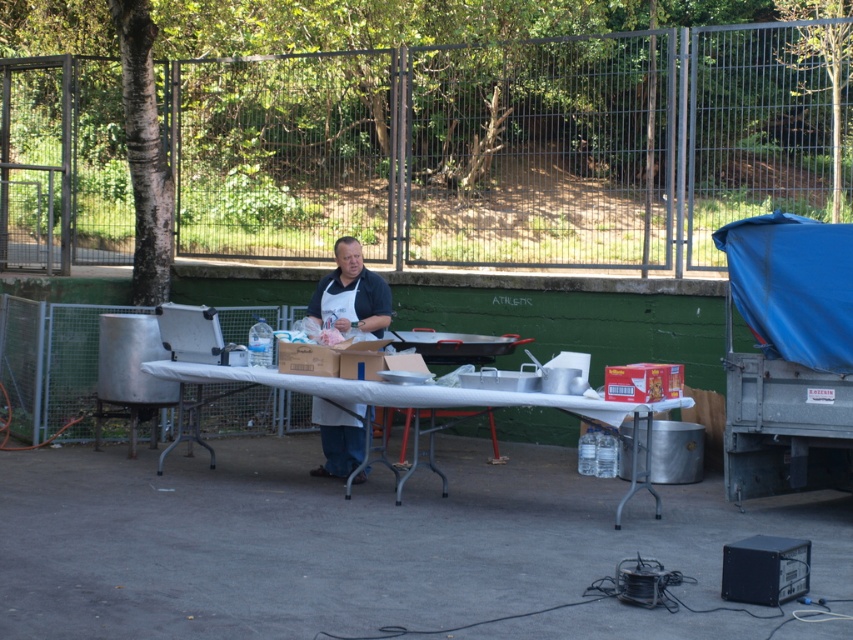
Looking at this image, does white plastic table at center come behind matte apron at center?

No.

Based on the photo, can you confirm if white plastic table at center is thinner than matte apron at center?

No, white plastic table at center is not thinner than matte apron at center.

The width and height of the screenshot is (853, 640). What are the coordinates of `white plastic table at center` in the screenshot? It's located at (407, 392).

At what (x,y) coordinates should I click in order to perform the action: click on white plastic table at center. Please return your answer as a coordinate pair (x, y). This screenshot has width=853, height=640. Looking at the image, I should click on (407, 392).

Can you confirm if matte apron at center is positioned below brown cardboard box at center?

Actually, matte apron at center is above brown cardboard box at center.

Is point (329, 320) closer to viewer compared to point (326, 374)?

No, it is behind (326, 374).

Is point (340, 300) farther from camera compared to point (329, 374)?

That is True.

Locate an element on the screen. This screenshot has height=640, width=853. matte apron at center is located at coordinates (351, 296).

Does white plastic table at center have a greater width compared to brown cardboard box at center?

Indeed, white plastic table at center has a greater width compared to brown cardboard box at center.

Can you confirm if white plastic table at center is positioned to the left of brown cardboard box at center?

Incorrect, white plastic table at center is not on the left side of brown cardboard box at center.

Measure the distance between white plastic table at center and camera.

A distance of 9.40 meters exists between white plastic table at center and camera.

Where is `white plastic table at center`? white plastic table at center is located at coordinates (407, 392).